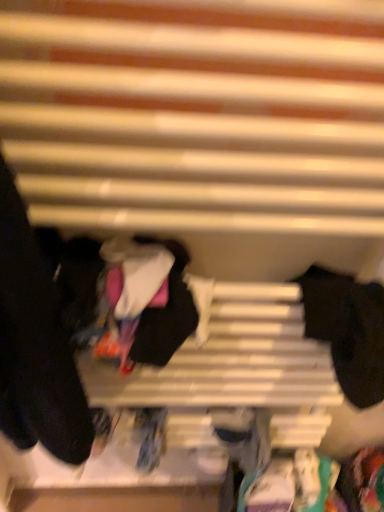
Question: Is black matte socks at right, placed as the second clothing when sorted from left to right, situated inside black matte socks at left, acting as the 2th clothing starting from the right, or outside?

Choices:
 (A) inside
 (B) outside

Answer: (B)

Question: From a real-world perspective, is black matte socks at right, which is the 1th clothing from right to left, positioned above or below black matte socks at left, acting as the 2th clothing starting from the right?

Choices:
 (A) below
 (B) above

Answer: (A)

Question: In terms of width, does black matte socks at right, which is the 1th clothing from right to left, look wider or thinner when compared to black matte socks at left, acting as the 2th clothing starting from the right?

Choices:
 (A) thin
 (B) wide

Answer: (A)

Question: Is point (31, 265) positioned closer to the camera than point (339, 281)?

Choices:
 (A) farther
 (B) closer

Answer: (B)

Question: From a real-world perspective, is black matte socks at left, acting as the 2th clothing starting from the right, physically located above or below black matte socks at right, placed as the second clothing when sorted from left to right?

Choices:
 (A) above
 (B) below

Answer: (A)

Question: Visually, is black matte socks at left, which is the 1th clothing from left to right, positioned to the left or to the right of black matte socks at right, which is the 1th clothing from right to left?

Choices:
 (A) left
 (B) right

Answer: (A)

Question: Considering the positions of black matte socks at left, acting as the 2th clothing starting from the right, and black matte socks at right, placed as the second clothing when sorted from left to right, in the image, is black matte socks at left, acting as the 2th clothing starting from the right, bigger or smaller than black matte socks at right, placed as the second clothing when sorted from left to right,?

Choices:
 (A) small
 (B) big

Answer: (B)